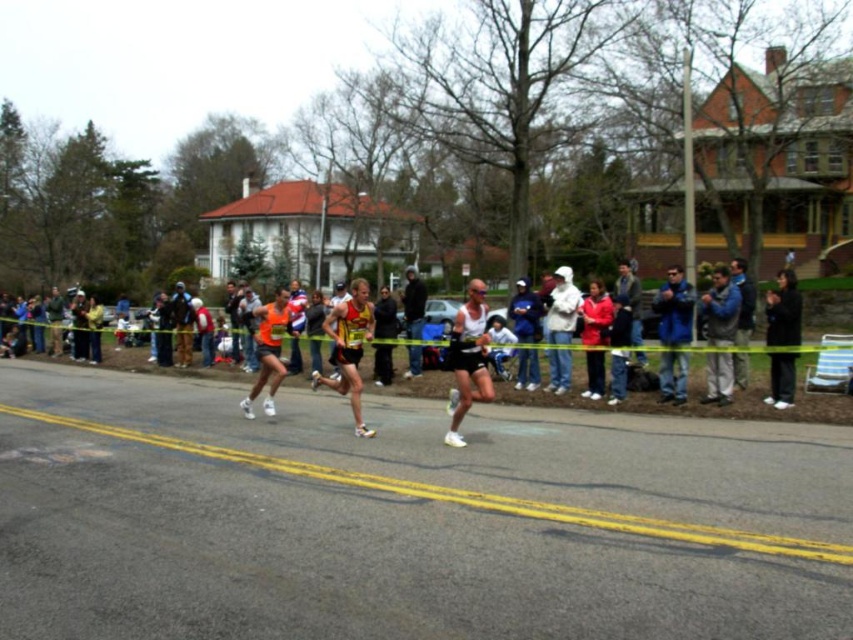
You are a photographer at the marathon event and want to capture a photo of both the jeans at center and the white cotton jacket at center. Which object should you focus on first if you want to include both in your shot without moving the camera?

The jeans at center should be focused on first since it is positioned to the left of the white cotton jacket at center, allowing the camera to capture both objects in the frame by adjusting the zoom or composition without moving the camera.

You are a photographer positioned at the center of the marathon scene. You want to capture a photo that includes both the orange fabric tank top at center and the white cotton jacket at center. Which of these two items will appear smaller in the photo?

The orange fabric tank top at center is not as tall as the white cotton jacket at center, so it will appear smaller in the photo.

From the picture: Looking at the marathon scene, where is the yellow asphalt at center in relation to the white matte tank top at center?

The yellow asphalt at center is to the left of the white matte tank top at center.